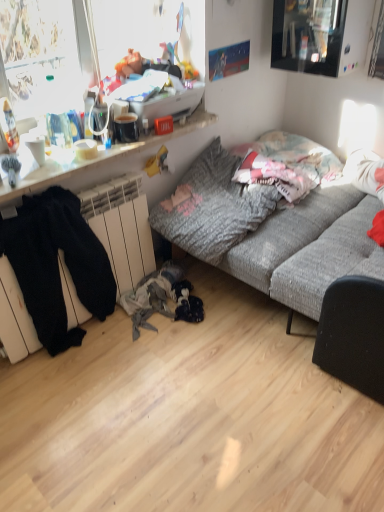
Question: From their relative heights in the image, would you say textured gray couch at center is taller or shorter than black cotton pants at lower left?

Choices:
 (A) short
 (B) tall

Answer: (A)

Question: Looking at the image, does textured gray couch at center seem bigger or smaller compared to black cotton pants at lower left?

Choices:
 (A) small
 (B) big

Answer: (B)

Question: Estimate the real-world distances between objects in this image. Which object is farther from the white glossy bowl at upper left?

Choices:
 (A) black cotton pants at lower left
 (B) textured gray couch at center
 (C) gray textured pillow at center
 (D) wooden desk at upper left

Answer: (B)

Question: Estimate the real-world distances between objects in this image. Which object is closer to the white glossy bowl at upper left?

Choices:
 (A) textured gray couch at center
 (B) wooden desk at upper left
 (C) gray textured pillow at center
 (D) black cotton pants at lower left

Answer: (B)